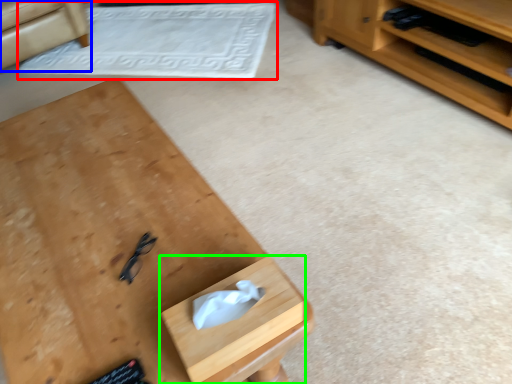
Question: Which is farther away from mat (highlighted by a red box)? armchair (highlighted by a blue box) or drawer (highlighted by a green box)?

Choices:
 (A) armchair
 (B) drawer

Answer: (B)